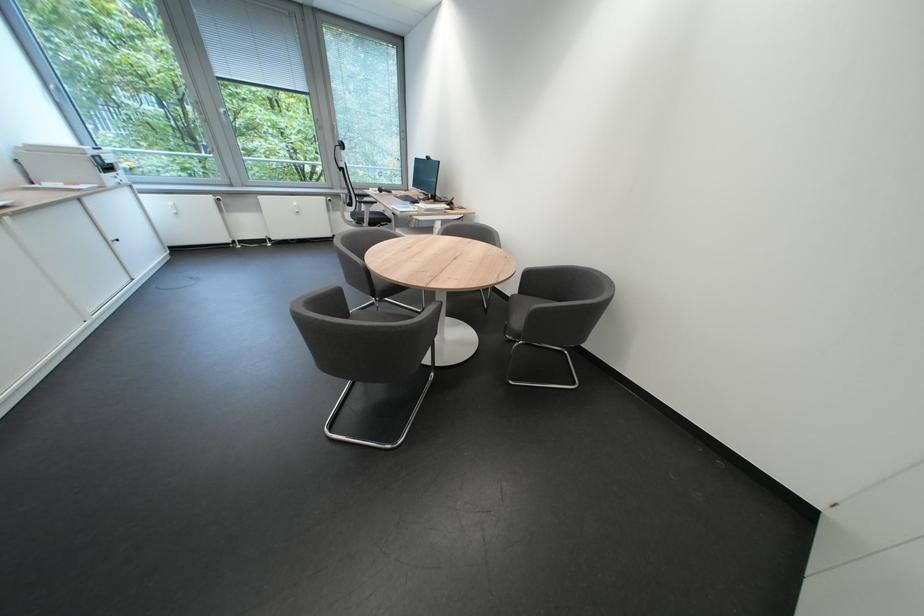
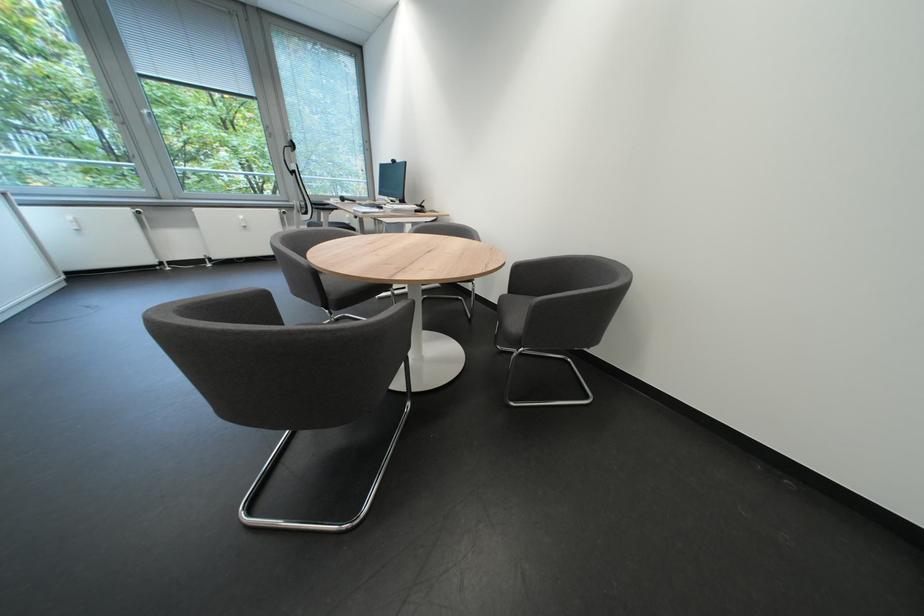
Question: What movement of the cameraman would produce the second image?

Choices:
 (A) Left
 (B) Right
 (C) Forward
 (D) Backward

Answer: (C)